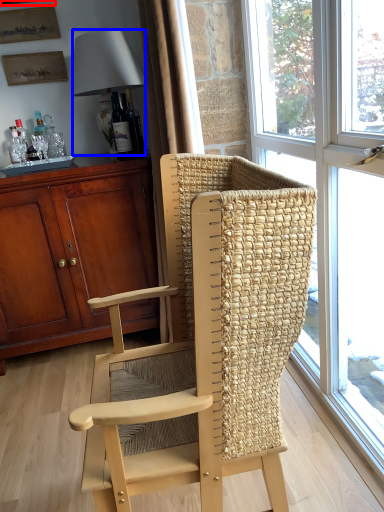
Question: Which point is further to the camera, picture frame (highlighted by a red box) or lamp (highlighted by a blue box)?

Choices:
 (A) picture frame
 (B) lamp

Answer: (A)